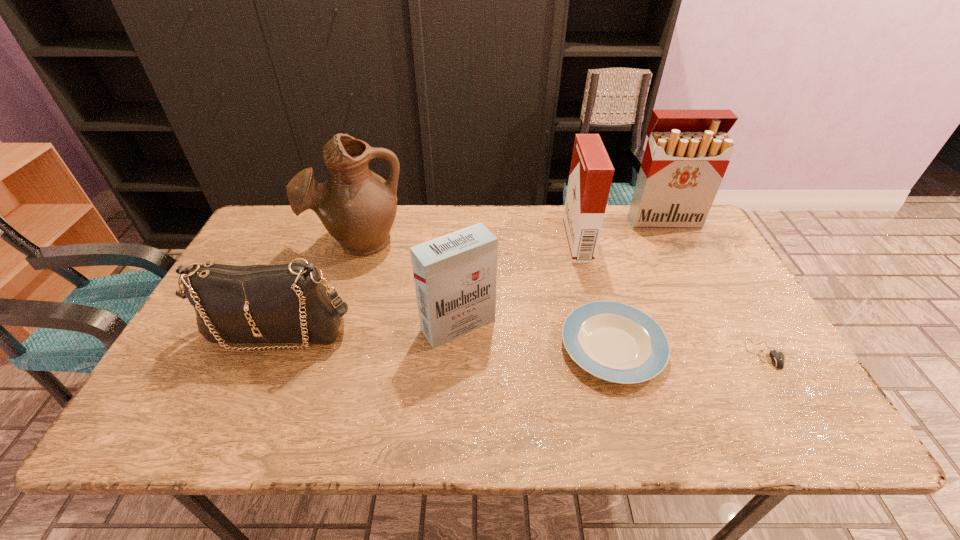
Locate an element on the screen. free location located 0.150m on the front-facing side of the second cigarette case from right to left is located at coordinates (519, 242).

The image size is (960, 540). I want to click on vacant point located on the front-facing side of the second cigarette case from right to left, so click(x=440, y=242).

Locate an element on the screen. vacant space located 0.260m on the front-facing side of the second cigarette case from right to left is located at coordinates (484, 242).

The width and height of the screenshot is (960, 540). Identify the location of free space located 0.120m on the front of the third object from left to right. (455, 392).

Locate an element on the screen. free location located 0.150m at the front of the handbag with chain and zipper is located at coordinates (242, 414).

At what (x,y) coordinates should I click in order to perform the action: click on vacant space situated on the back of the plate. Please return your answer as a coordinate pair (x, y). The height and width of the screenshot is (540, 960). Looking at the image, I should click on (583, 239).

In order to click on vacant space positioned on the back of the computer mouse in this screenshot , I will do `click(710, 261)`.

The image size is (960, 540). I want to click on pitcher present at the far edge, so click(x=357, y=207).

Image resolution: width=960 pixels, height=540 pixels. Find the location of `object present at the left edge`. object present at the left edge is located at coordinates (288, 303).

Find the location of `cigarette case that is positioned at the right edge`. cigarette case that is positioned at the right edge is located at coordinates (687, 154).